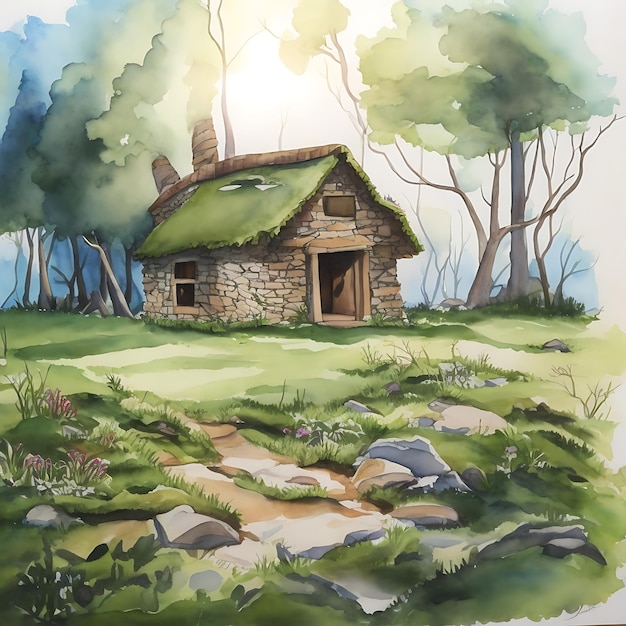
The width and height of the screenshot is (626, 626). Find the location of `wall`. wall is located at coordinates (253, 272).